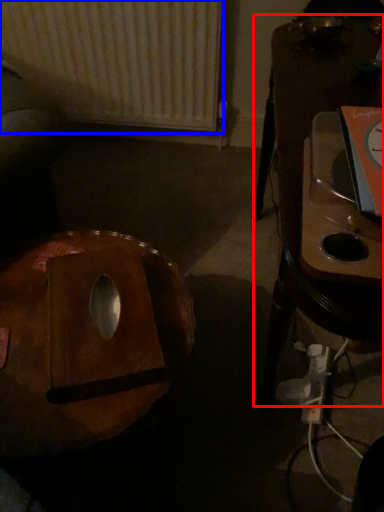
Question: Which of the following is the farthest to the observer, furniture (highlighted by a red box) or radiator (highlighted by a blue box)?

Choices:
 (A) furniture
 (B) radiator

Answer: (B)